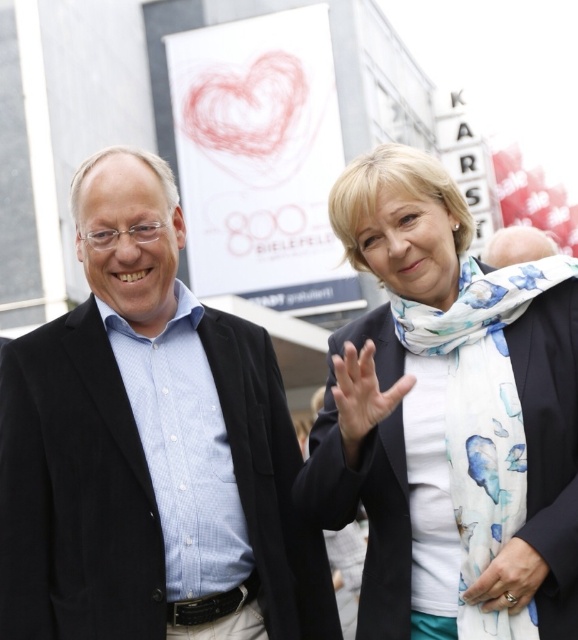
You are standing at the event and want to take a photo of the point at coordinates (173, 502). The camera you have can only focus on objects within 60 feet. Will the point be in focus?

The point at coordinates (173, 502) is 68.84 feet away from the viewer, which is beyond the camera focus range of 60 feet. Therefore, the point will not be in focus.

You are standing 20 meters away from the scene described. You want to take a photo of the white floral scarf at center. Will you be able to capture it clearly in your photo?

The white floral scarf at center and viewer are 17.98 meters apart. Since you are standing 20 meters away, you are farther than the required distance. Therefore, you might not be able to capture it clearly in your photo.

Based on the photo, you are a photographer trying to capture a closeup shot of the white floral scarf at center and the white floral scarf at upper center. Which scarf should you focus on first to ensure both are in the frame without moving the camera? Please explain your reasoning based on their positions.

The white floral scarf at center is positioned on the right side of white floral scarf at upper center. Therefore, focusing on the white floral scarf at upper center first would allow you to include both in the frame since it is closer to the center and the other is to its right.